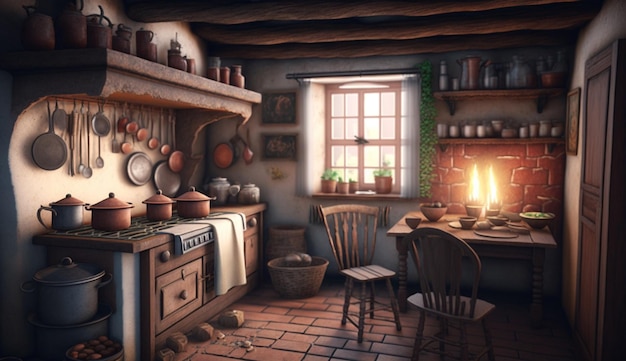
Where is `center of window`? center of window is located at coordinates (360, 142).